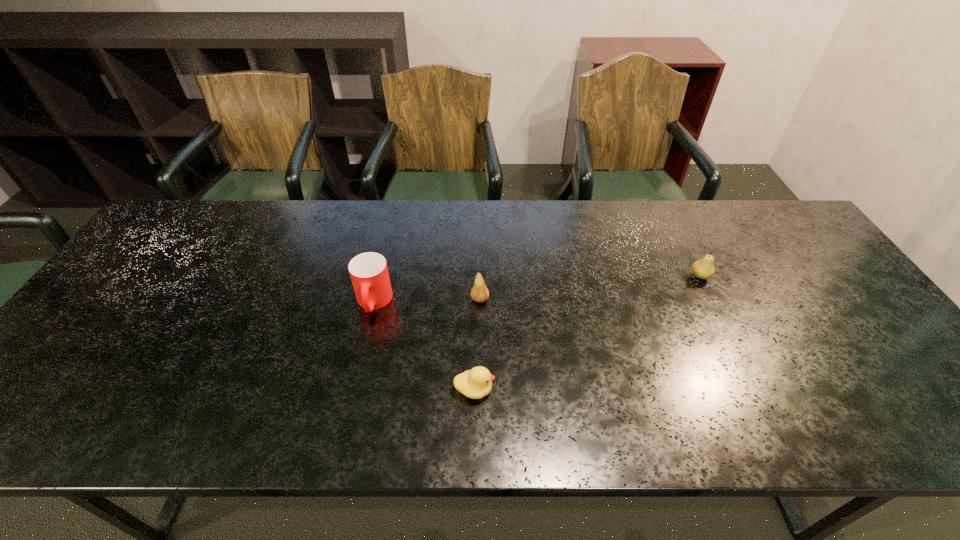
Locate an element on the screen. The width and height of the screenshot is (960, 540). cup is located at coordinates (369, 274).

This screenshot has width=960, height=540. In order to click on the tallest object in this screenshot , I will do `click(369, 274)`.

Locate an element on the screen. The height and width of the screenshot is (540, 960). the farther pear is located at coordinates (703, 269).

Where is `the right pear`? The width and height of the screenshot is (960, 540). the right pear is located at coordinates (703, 269).

I want to click on the nearer pear, so click(479, 293).

Where is `duckling`? Image resolution: width=960 pixels, height=540 pixels. duckling is located at coordinates (476, 383).

The width and height of the screenshot is (960, 540). Find the location of `the nearest object`. the nearest object is located at coordinates (476, 383).

Identify the location of free location located 0.140m on the side of the cup with the handle. This screenshot has height=540, width=960. (359, 369).

The width and height of the screenshot is (960, 540). Find the location of `vacant space situated 0.170m on the left of the farther pear`. vacant space situated 0.170m on the left of the farther pear is located at coordinates (629, 277).

Locate an element on the screen. vacant space located on the back of the nearer pear is located at coordinates 480,258.